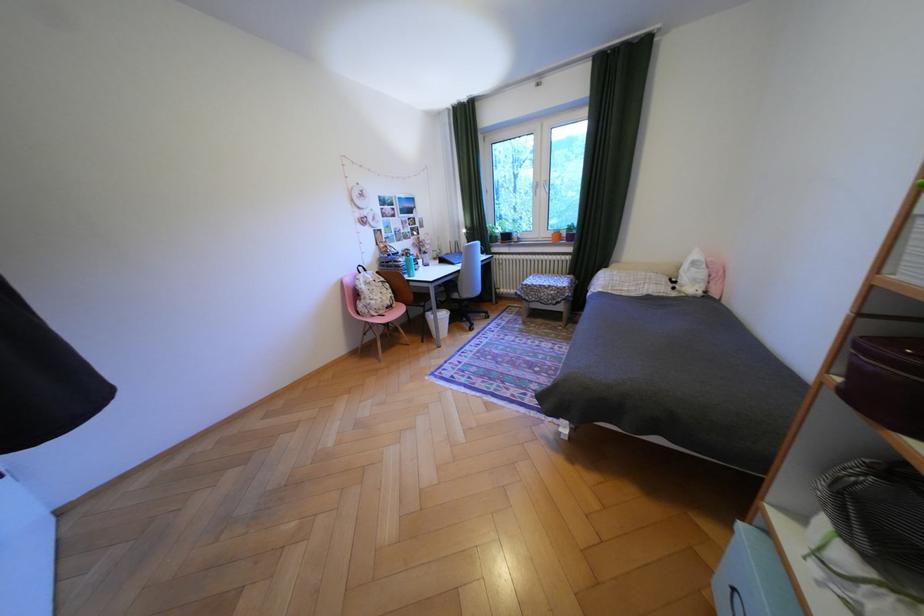
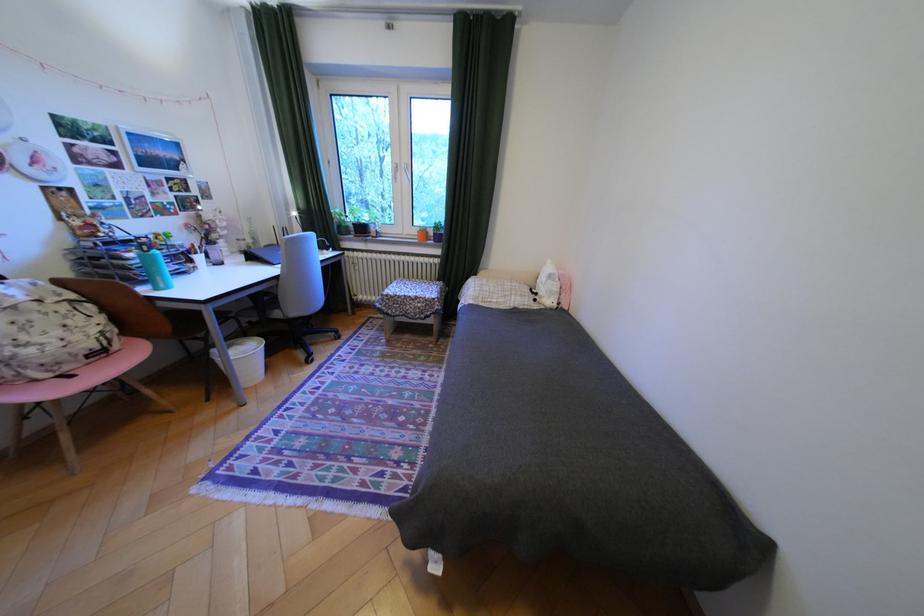
Which direction would the cameraman need to move to produce the second image?

The movement direction of the cameraman is right, forward.